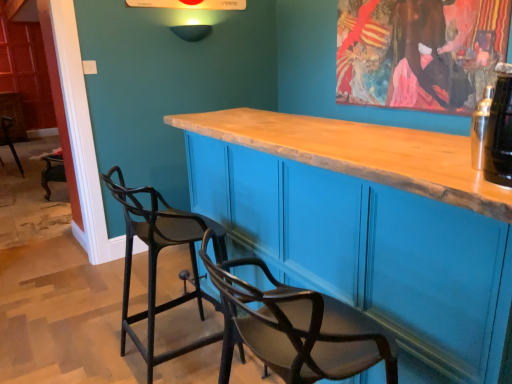
This screenshot has height=384, width=512. Identify the location of blank space to the left of black glass bottle at upper right. (442, 174).